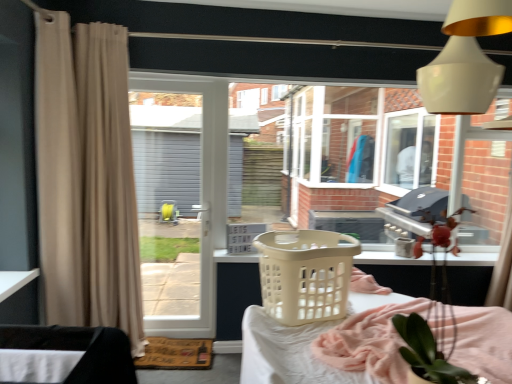
How much space does black fabric at lower left, which is counted as the 2th furniture, starting from the back, occupy vertically?

black fabric at lower left, which is counted as the 2th furniture, starting from the back, is 9.49 inches in height.

Measure the distance between point (16,357) and camera.

Point (16,357) is 1.37 meters away from camera.

I want to click on beige plastic basket at center, which is counted as the 2th basket, starting from the back, so click(x=305, y=274).

In terms of size, does beige fabric curtain at left, positioned as the first curtain in left-to-right order, appear bigger or smaller than white fabric at lower left?

In the image, beige fabric curtain at left, positioned as the first curtain in left-to-right order, appears to be larger than white fabric at lower left.

Who is more distant, beige fabric curtain at left, positioned as the first curtain in left-to-right order, or white fabric at lower left?

beige fabric curtain at left, positioned as the first curtain in left-to-right order, is further from the camera.

Considering the sizes of objects beige fabric curtain at left, acting as the second curtain starting from the right, and white fabric at lower left in the image provided, who is taller, beige fabric curtain at left, acting as the second curtain starting from the right, or white fabric at lower left?

beige fabric curtain at left, acting as the second curtain starting from the right.

Considering the relative sizes of green leafy plant at lower right and white glossy door at center in the image provided, is green leafy plant at lower right smaller than white glossy door at center?

Correct, green leafy plant at lower right occupies less space than white glossy door at center.

Is green leafy plant at lower right outside of white glossy door at center?

green leafy plant at lower right lies outside white glossy door at center's area.

From their relative heights in the image, would you say green leafy plant at lower right is taller or shorter than white glossy door at center?

Considering their sizes, green leafy plant at lower right has less height than white glossy door at center.

From the picture: Considering the sizes of green leafy plant at lower right and white glossy door at center in the image, is green leafy plant at lower right wider or thinner than white glossy door at center?

Clearly, green leafy plant at lower right has more width compared to white glossy door at center.

Considering the positions of objects beige fabric curtain at left, the 1th curtain when ordered from right to left, and black fabric at lower left, which is the 2th furniture in right-to-left order, in the image provided, who is more to the left, beige fabric curtain at left, the 1th curtain when ordered from right to left, or black fabric at lower left, which is the 2th furniture in right-to-left order,?

From the viewer's perspective, beige fabric curtain at left, the 1th curtain when ordered from right to left, appears more on the left side.

From a real-world perspective, is beige fabric curtain at left, the 1th curtain when ordered from right to left, on black fabric at lower left, which is the 2th furniture in right-to-left order?

Correct, in the physical world, beige fabric curtain at left, the 1th curtain when ordered from right to left, is higher than black fabric at lower left, which is the 2th furniture in right-to-left order.

Starting from the black fabric at lower left, which is counted as the 2th furniture, starting from the back, which curtain is the 2nd one behind? Please provide its 2D coordinates.

[(87, 178)]

Can you confirm if beige fabric curtain at left, the 1th curtain when ordered from right to left, is shorter than black fabric at lower left, which is the 2th furniture in right-to-left order?

No.

Who is more distant, beige fabric curtain at left, the 1th curtain when ordered from right to left, or white plastic laundry basket at center, which is the 1th basket from back to front?

white plastic laundry basket at center, which is the 1th basket from back to front.

Which is closer to the camera, (77, 58) or (246, 250)?

The point (77, 58) is closer to the camera.

From a real-world perspective, is beige fabric curtain at left, the 1th curtain when ordered from right to left, physically located above or below white plastic laundry basket at center, which is the 1th basket from back to front?

From a real-world perspective, beige fabric curtain at left, the 1th curtain when ordered from right to left, is physically above white plastic laundry basket at center, which is the 1th basket from back to front.

From the image's perspective, is beige fabric curtain at left, which appears as the second curtain when viewed from the left, above or below white plastic laundry basket at center, which is the 1th basket from back to front?

beige fabric curtain at left, which appears as the second curtain when viewed from the left, is above white plastic laundry basket at center, which is the 1th basket from back to front.

Which is less distant, (471,101) or (486,320)?

Result: The point (471,101) is closer to the camera.

There is a white glossy lampshade at upper right. Find the location of `the 2nd furniture below it (from the image's perspective)`. the 2nd furniture below it (from the image's perspective) is located at coordinates (330, 342).

Can you confirm if white glossy lampshade at upper right is positioned to the left of beige plastic laundry basket at lower center, the second furniture viewed from the left?

No, white glossy lampshade at upper right is not to the left of beige plastic laundry basket at lower center, the second furniture viewed from the left.

Considering the relative sizes of white glossy lampshade at upper right and beige plastic laundry basket at lower center, the second furniture viewed from the left, in the image provided, is white glossy lampshade at upper right bigger than beige plastic laundry basket at lower center, the second furniture viewed from the left,?

No.

Based on the photo, from a real-world perspective, is beige plastic laundry basket at lower center, the first furniture when ordered from right to left, physically located above or below beige plastic basket at center, which is counted as the 2th basket, starting from the back?

Clearly, from a real-world perspective, beige plastic laundry basket at lower center, the first furniture when ordered from right to left, is below beige plastic basket at center, which is counted as the 2th basket, starting from the back.

In the scene shown: Is beige plastic laundry basket at lower center, the second furniture viewed from the left, surrounding beige plastic basket at center, placed as the 1th basket when sorted from front to back?

No, beige plastic basket at center, placed as the 1th basket when sorted from front to back, is not surrounded by beige plastic laundry basket at lower center, the second furniture viewed from the left.

What's the angular difference between beige plastic laundry basket at lower center, the first furniture when ordered from right to left, and beige plastic basket at center, which is counted as the 2th basket, starting from the back,'s facing directions?

0.000258 degrees separate the facing orientations of beige plastic laundry basket at lower center, the first furniture when ordered from right to left, and beige plastic basket at center, which is counted as the 2th basket, starting from the back.

Is beige plastic laundry basket at lower center, marked as the 1th furniture in a back-to-front arrangement, taller than beige plastic basket at center, placed as the 1th basket when sorted from front to back?

Yes, beige plastic laundry basket at lower center, marked as the 1th furniture in a back-to-front arrangement, is taller than beige plastic basket at center, placed as the 1th basket when sorted from front to back.

From a real-world perspective, between green leafy plant at lower right and beige fabric curtain at left, acting as the second curtain starting from the right, who is vertically higher?

beige fabric curtain at left, acting as the second curtain starting from the right, is physically above.

Which object is positioned more to the right, green leafy plant at lower right or beige fabric curtain at left, positioned as the first curtain in left-to-right order?

From the viewer's perspective, green leafy plant at lower right appears more on the right side.

From the image's perspective, between green leafy plant at lower right and beige fabric curtain at left, positioned as the first curtain in left-to-right order, which one is located above?

beige fabric curtain at left, positioned as the first curtain in left-to-right order, is shown above in the image.

Identify the location of the 2nd curtain counting from the left of the white fabric at lower left. pos(58,171).

There is a green leafy plant at lower right. Find the location of `door above it (from a real-world perspective)`. door above it (from a real-world perspective) is located at coordinates (181, 197).

Considering their positions, is beige fabric curtain at left, positioned as the first curtain in left-to-right order, positioned further to green leafy plant at lower right than white glossy door at center?

white glossy door at center is positioned further to the anchor green leafy plant at lower right.

From the picture: Based on their spatial positions, is green leafy plant at lower right or black fabric at lower left, the 1th furniture in the left-to-right sequence, further from white fabric at lower left?

Based on the image, green leafy plant at lower right appears to be further to white fabric at lower left.

Estimate the real-world distances between objects in this image. Which object is closer to beige plastic laundry basket at lower center, the second furniture in the front-to-back sequence, beige plastic basket at center, which is counted as the 2th basket, starting from the back, or white fabric at lower left?

beige plastic basket at center, which is counted as the 2th basket, starting from the back, is closer to beige plastic laundry basket at lower center, the second furniture in the front-to-back sequence.

Looking at the image, which one is located closer to white plastic laundry basket at center, positioned as the 2th basket in front-to-back order, white glossy lampshade at upper right or green leafy plant at lower right?

green leafy plant at lower right lies closer to white plastic laundry basket at center, positioned as the 2th basket in front-to-back order, than the other object.

Which object lies nearer to the anchor point white plastic laundry basket at center, positioned as the 2th basket in front-to-back order, black fabric at lower left, the 1th furniture in the left-to-right sequence, or white glossy door at center?

white glossy door at center lies closer to white plastic laundry basket at center, positioned as the 2th basket in front-to-back order, than the other object.

Which object lies further to the anchor point beige plastic basket at center, which is counted as the 2th basket, starting from the back, beige fabric curtain at left, acting as the second curtain starting from the right, or white plastic laundry basket at center, positioned as the 2th basket in front-to-back order?

beige fabric curtain at left, acting as the second curtain starting from the right, lies further to beige plastic basket at center, which is counted as the 2th basket, starting from the back, than the other object.

Based on their spatial positions, is green leafy plant at lower right or white glossy lampshade at upper right closer to beige fabric curtain at left, positioned as the first curtain in left-to-right order?

green leafy plant at lower right is closer to beige fabric curtain at left, positioned as the first curtain in left-to-right order.

Based on their spatial positions, is beige plastic laundry basket at lower center, marked as the 1th furniture in a back-to-front arrangement, or white glossy lampshade at upper right further from beige fabric curtain at left, the 1th curtain when ordered from right to left?

Among the two, white glossy lampshade at upper right is located further to beige fabric curtain at left, the 1th curtain when ordered from right to left.

At what (x,y) coordinates should I click in order to perform the action: click on furniture between black fabric at lower left, which is counted as the 2th furniture, starting from the back, and white plastic laundry basket at center, positioned as the 2th basket in front-to-back order, from front to back. Please return your answer as a coordinate pair (x, y). Image resolution: width=512 pixels, height=384 pixels. Looking at the image, I should click on (330, 342).

In order to click on basket between beige plastic laundry basket at lower center, the second furniture viewed from the left, and white glossy door at center from front to back in this screenshot , I will do `click(305, 274)`.

The image size is (512, 384). Identify the location of curtain positioned between beige fabric curtain at left, acting as the second curtain starting from the right, and white glossy door at center from near to far. (87, 178).

Where is `table located between white glossy lampshade at upper right and white glossy door at center in the depth direction`? The image size is (512, 384). table located between white glossy lampshade at upper right and white glossy door at center in the depth direction is located at coordinates (37, 365).